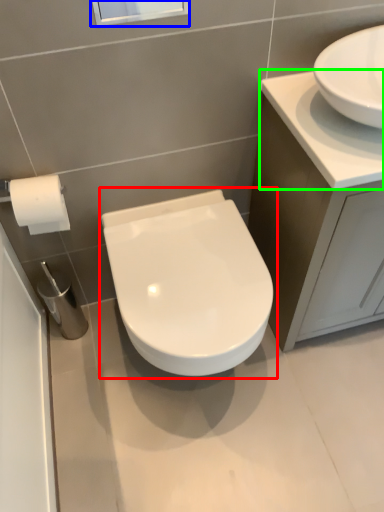
Question: Considering the real-world distances, which object is farthest from toilet (highlighted by a red box)? window screen (highlighted by a blue box) or counter top (highlighted by a green box)?

Choices:
 (A) window screen
 (B) counter top

Answer: (A)